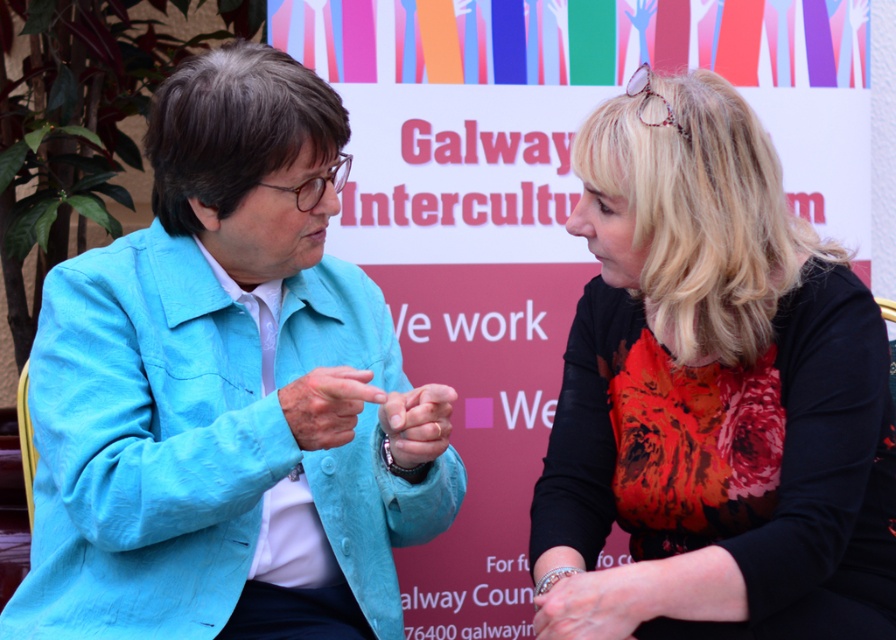
Who is shorter, matte blue finger at center or silver metallic bracelet at lower center?

Standing shorter between the two is silver metallic bracelet at lower center.

Who is lower down, matte blue finger at center or silver metallic bracelet at lower center?

silver metallic bracelet at lower center is lower down.

Is point (338, 419) farther from camera compared to point (536, 580)?

No.

Find the location of a particular element. The image size is (896, 640). matte blue finger at center is located at coordinates (326, 404).

Can you confirm if matte blue jacket at center is positioned below silver metallic bracelet at lower center?

Incorrect, matte blue jacket at center is not positioned below silver metallic bracelet at lower center.

Is point (156, 428) positioned behind point (547, 618)?

Yes, point (156, 428) is farther from viewer.

In order to click on matte blue jacket at center in this screenshot , I will do `click(220, 390)`.

Is point (751, 582) more distant than point (367, 396)?

No, (751, 582) is in front of (367, 396).

Is floral print blouse at center below matte blue finger at center?

Incorrect, floral print blouse at center is not positioned below matte blue finger at center.

Where is `floral print blouse at center`? The image size is (896, 640). floral print blouse at center is located at coordinates (714, 392).

I want to click on floral print blouse at center, so click(x=714, y=392).